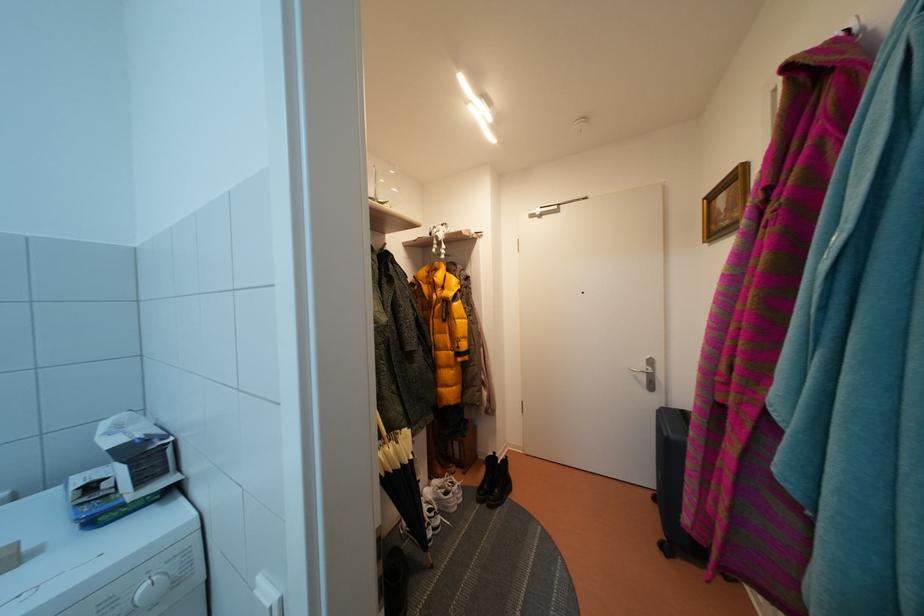
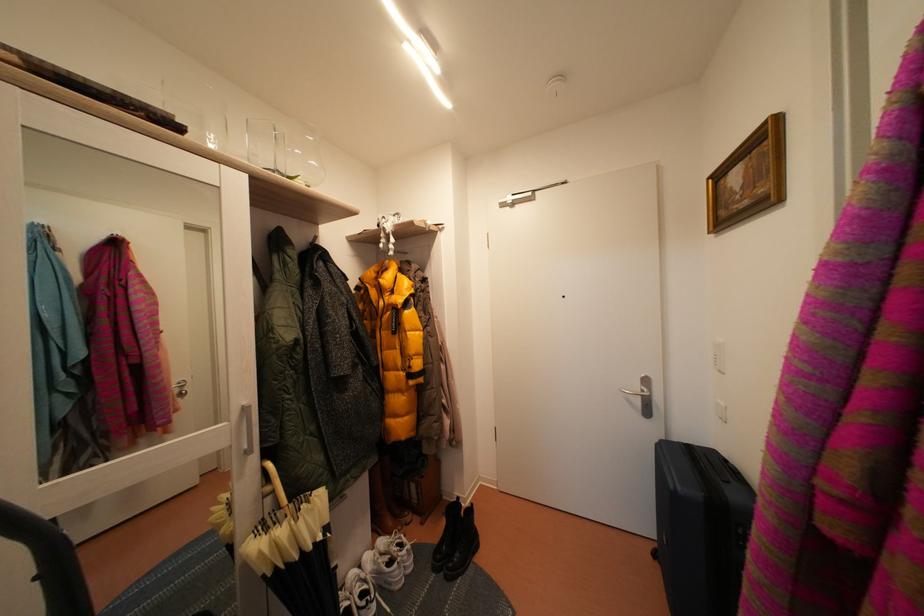
Where in the second image is the point corresponding to point (484, 483) from the first image?

(444, 536)